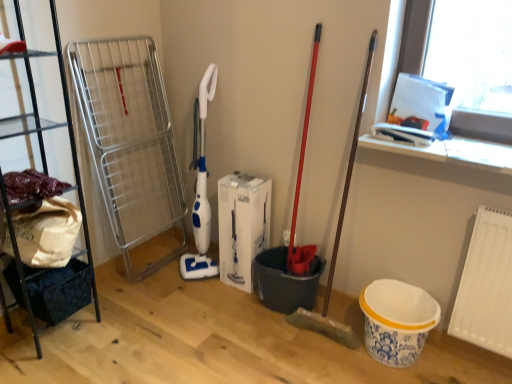
Find the location of `vacant area that is situated to the right of black metal shelf at left`. vacant area that is situated to the right of black metal shelf at left is located at coordinates (120, 330).